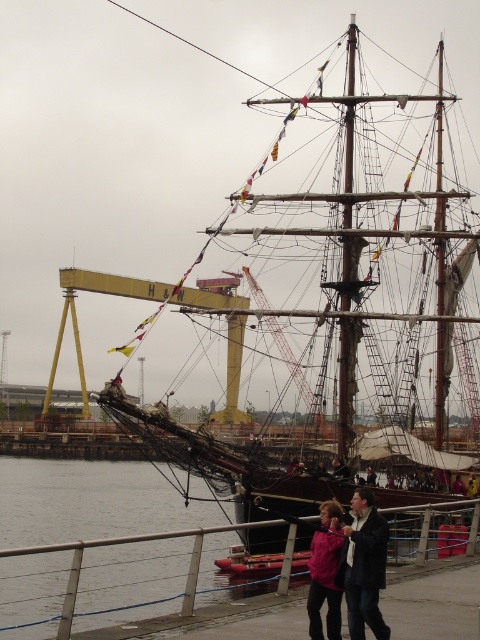
You are standing on the walkway and want to get a clear view of the wooden ship at center without the dark pink fabric jacket at lower center blocking your sight. Which direction should you move to ensure the ship is no longer behind the jacket?

The wooden ship at center is positioned over dark pink fabric jacket at lower center, so if you move to the side away from the ship, you can avoid the jacket blocking the view.

You are standing on the walkway and want to move from the point closer to you to the point farther away. Which path should you take between the two points, point (111, 472) and point (313, 593)?

You should move from point (111, 472) to point (313, 593) because point (111, 472) is closer to you and point (313, 593) is farther away.

Consider the image. You are standing on the paved walkway with the metal railing and see the wooden ship at center. If you want to take a photo of the ship from the walkway, where should you position yourself to ensure the ship is centered in your camera frame?

The wooden ship at center is located at point [361,262], so you should position yourself directly in front of the ship along the walkway to center it in your camera frame.